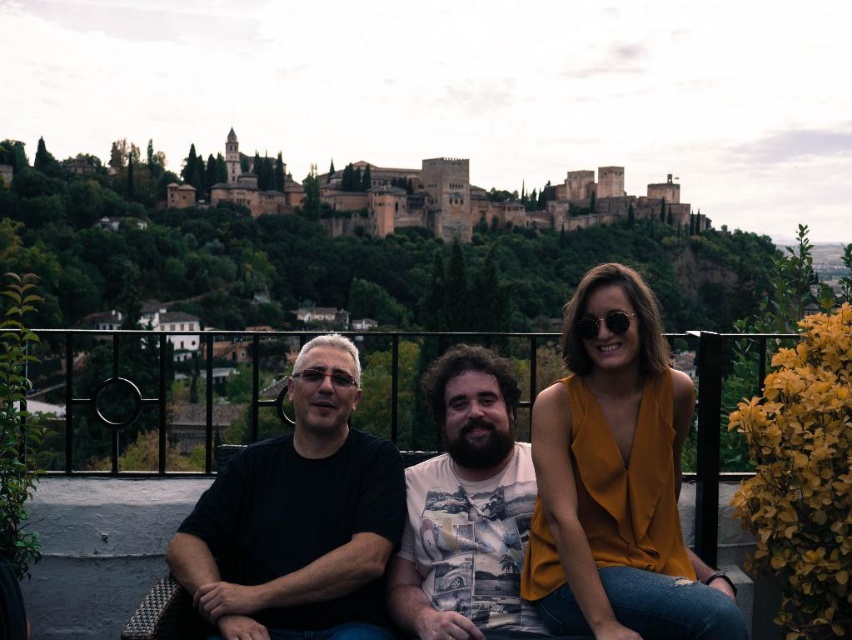
In the scene shown: You are a photographer trying to capture a clear photo of the black matte shirt at center and the black metal railing at center. Which object will appear larger in your photo?

The black matte shirt at center will appear larger in the photo because it is closer to the viewer than the black metal railing at center.